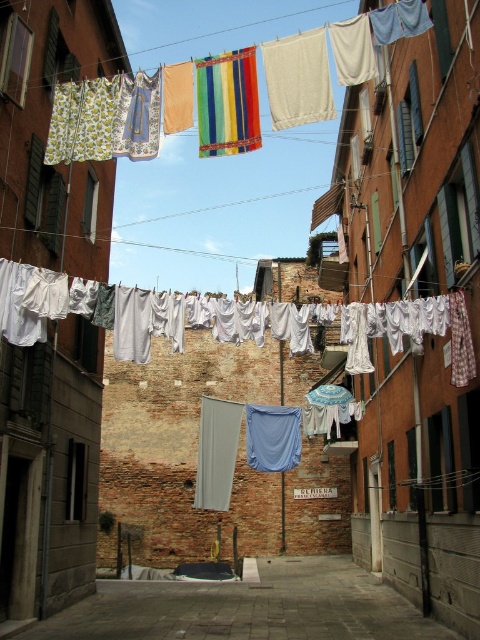
You are a delivery person trying to navigate through the alley. You see the smooth concrete pavement at center and the white fabric at center. Which object is positioned to the left?

The smooth concrete pavement at center is to the left of white fabric at center.

You are a delivery person trying to navigate through the alley. You see the smooth concrete pavement at center and the white fabric at center. Which one is closer to you as you walk towards them?

The smooth concrete pavement at center is closer to you than the white fabric at center because it is further to the viewer.